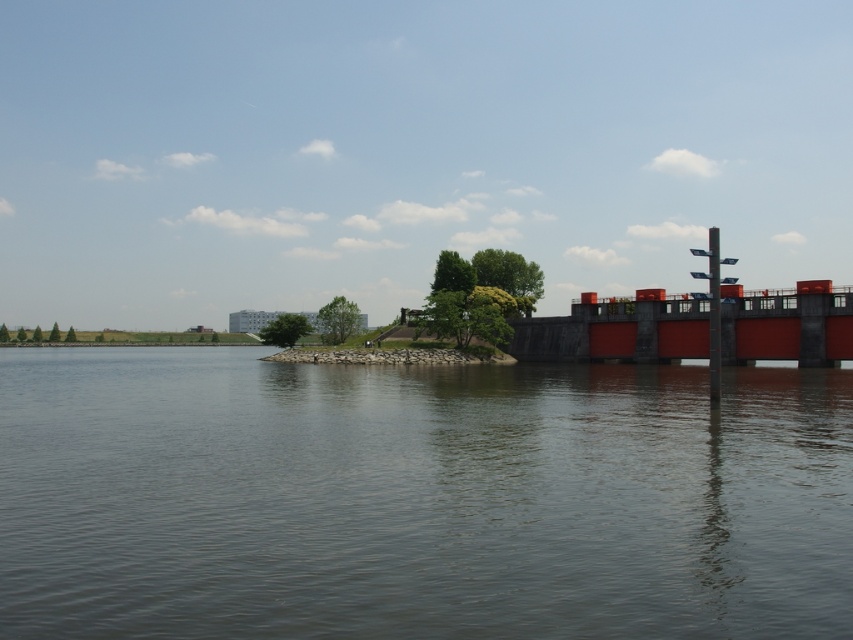
You are a photographer planning to capture the smooth water at center and the matte red bridge at right in a single frame. Based on their sizes, which object should you focus on to ensure both are clearly visible in your composition?

The smooth water at center has a larger width than the matte red bridge at right, so focusing on the smooth water at center would allow both objects to be clearly visible in the composition.

You are standing at the riverside and want to take a photo of the point at coordinates point (708, 476). If your camera has a maximum focus range of 15 meters, will it be able to focus on that point?

The distance of point (708, 476) from camera is 15.86 meters, which exceeds the camera maximum focus range of 15 meters. So the camera cannot focus on that point.

Consider the image. You are a photographer planning to capture a landscape shot of the smooth water at center and the matte red bridge at right. Based on their heights, which object should you focus on first if you want to ensure both are in the same frame without adjusting your camera angle?

The smooth water at center has a lesser height compared to the matte red bridge at right, so you should focus on the matte red bridge at right first to ensure both are in the same frame without adjusting your camera angle.